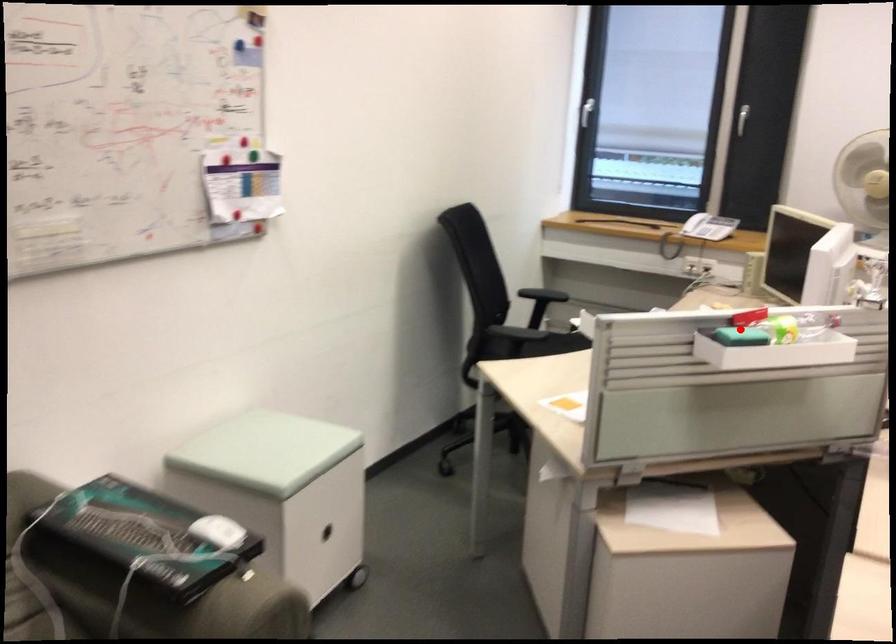
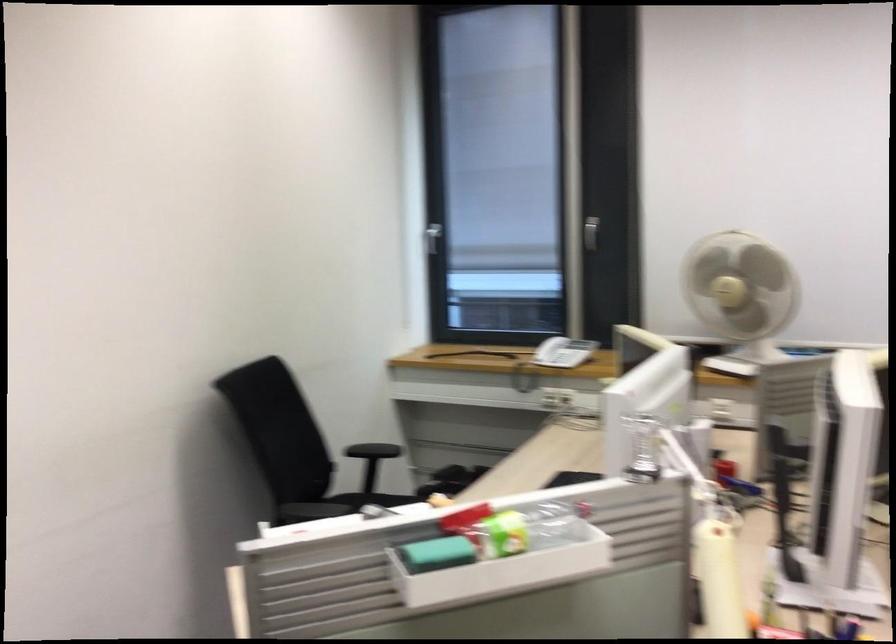
Find the pixel in the second image that matches the highlighted location in the first image.

(436, 554)